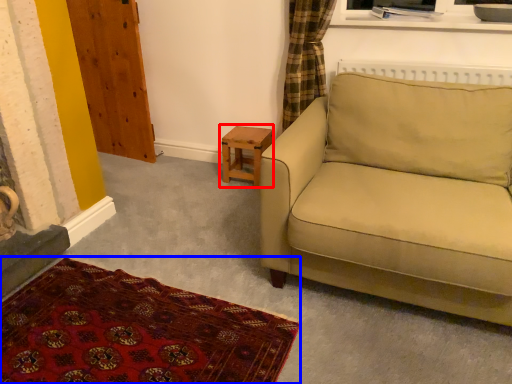
Question: Which object appears farthest to the camera in this image, table (highlighted by a red box) or plain (highlighted by a blue box)?

Choices:
 (A) table
 (B) plain

Answer: (A)